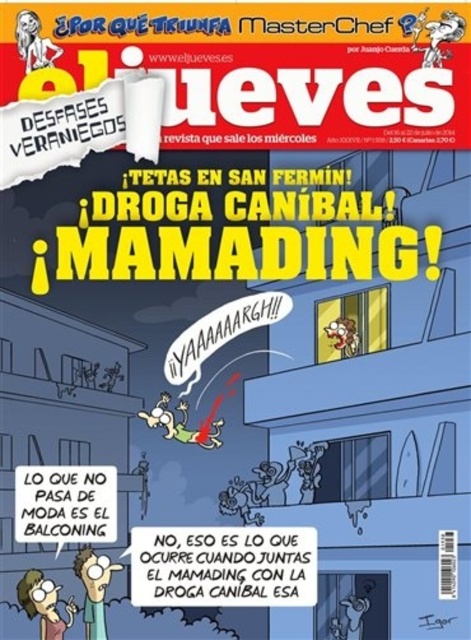
Is light blue shirt at lower left closer to the viewer compared to matte yellow head at upper left?

Yes, light blue shirt at lower left is in front of matte yellow head at upper left.

Which is more to the left, light blue shirt at lower left or matte yellow head at upper left?

matte yellow head at upper left is more to the left.

Locate an element on the screen. This screenshot has width=471, height=640. light blue shirt at lower left is located at coordinates (94, 589).

Is matte green shirt at lower left bigger than light blue shirt at lower left?

No, matte green shirt at lower left is not bigger than light blue shirt at lower left.

From the picture: Is matte green shirt at lower left thinner than light blue shirt at lower left?

In fact, matte green shirt at lower left might be wider than light blue shirt at lower left.

Is point (27, 580) positioned after point (82, 611)?

Yes, point (27, 580) is farther from viewer.

This screenshot has height=640, width=471. Find the location of `matte green shirt at lower left`. matte green shirt at lower left is located at coordinates (43, 604).

In the scene shown: Can you confirm if matte green shirt at lower left is positioned above matte yellow head at upper left?

No.

Is matte green shirt at lower left smaller than matte yellow head at upper left?

Actually, matte green shirt at lower left might be larger than matte yellow head at upper left.

You are a GUI agent. You are given a task and a screenshot of the screen. Output one action in this format:
    pyautogui.click(x=<x>, y=<y>)
    Task: Click on the matte green shirt at lower left
    This screenshot has width=471, height=640.
    Given the screenshot: What is the action you would take?
    pyautogui.click(x=43, y=604)